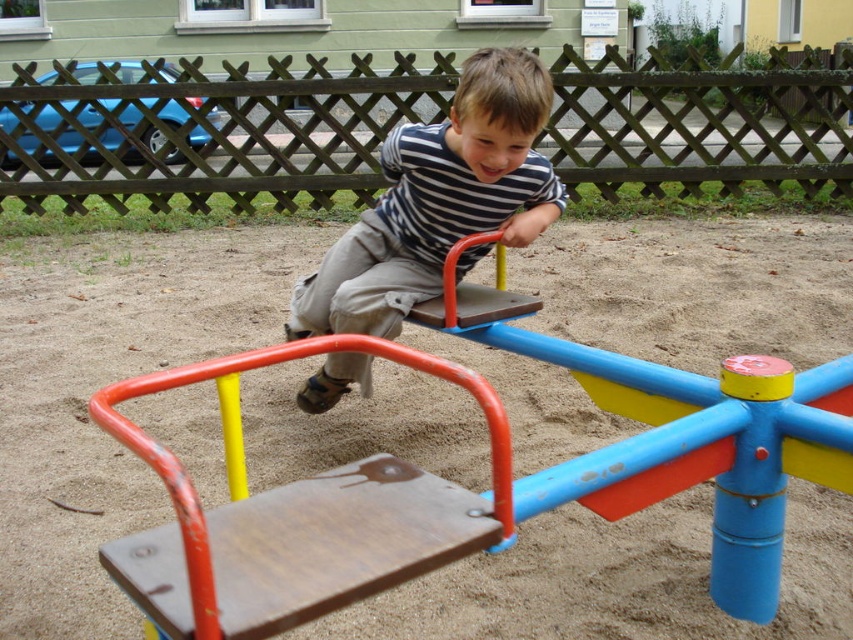
Does brown wooden sand at center lie in front of striped fabric shirt at center?

Yes, it is in front of striped fabric shirt at center.

In the scene shown: Is brown wooden sand at center shorter than striped fabric shirt at center?

In fact, brown wooden sand at center may be taller than striped fabric shirt at center.

Does point (631, 227) come closer to viewer compared to point (300, 310)?

No, it is behind (300, 310).

Image resolution: width=853 pixels, height=640 pixels. Find the location of `brown wooden sand at center`. brown wooden sand at center is located at coordinates (106, 384).